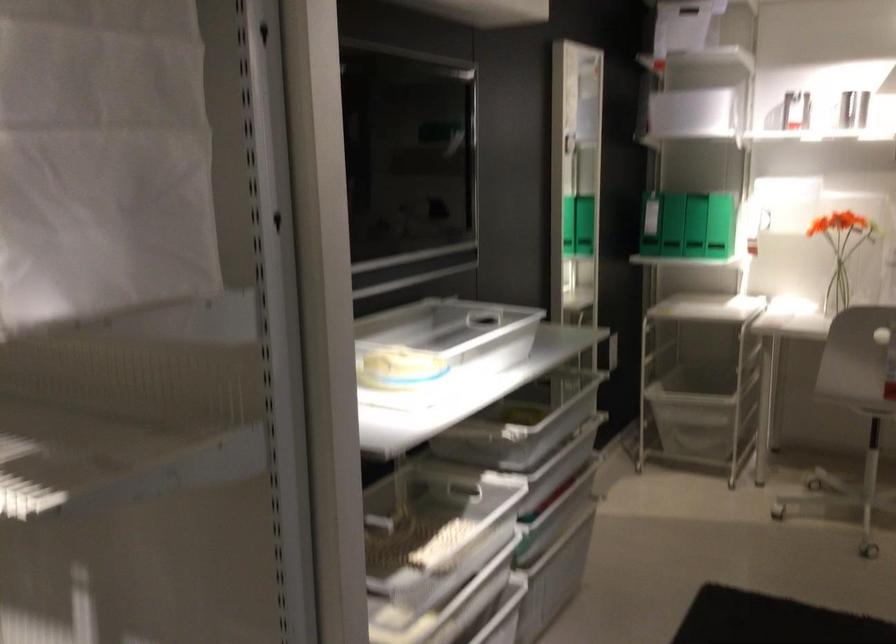
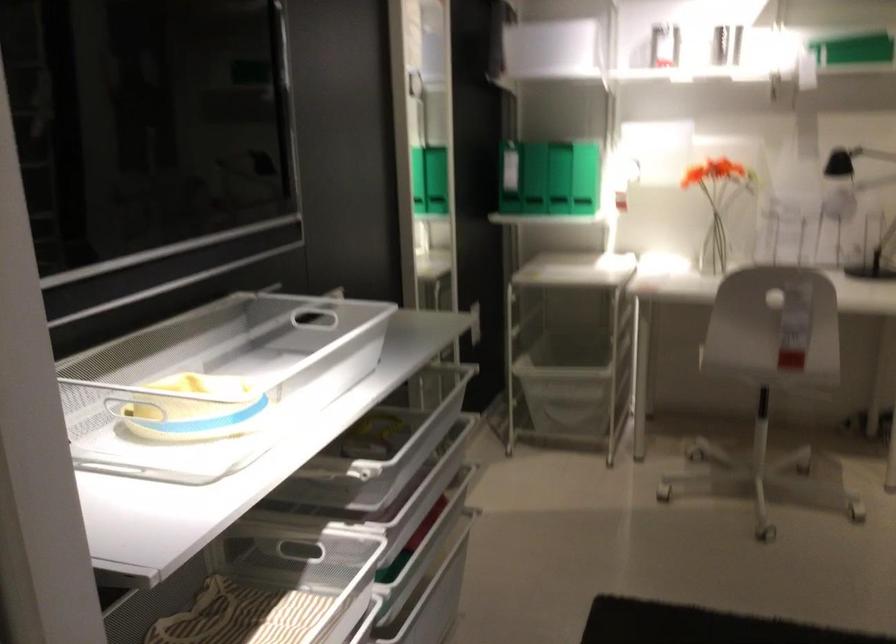
The point at (720,97) is marked in the first image. Where is the corresponding point in the second image?

(556, 46)